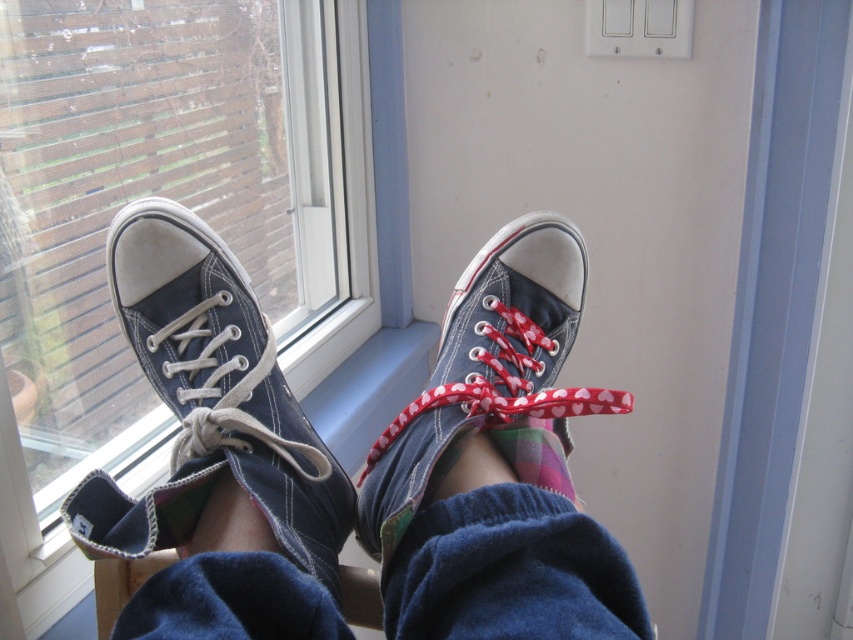
You are a delivery robot trying to place a package on the windowsill. The windowsill is light blue, and you see a dark blue canvas shoe at center located at point (216,396). Where should you place the package so it doesn not fall off the windowsill?

Place the package away from the dark blue canvas shoe at center located at point (216,396) to ensure it stays on the windowsill.

You are standing in a room and want to place a 60 cm wide painting on the wall between the transparent glass window at left and the viewer. Is there enough space?

The distance between the transparent glass window at left and the viewer is 65.33 centimeters. Since the painting is 60 cm wide, it will fit as 65.33 cm is more than 60 cm.